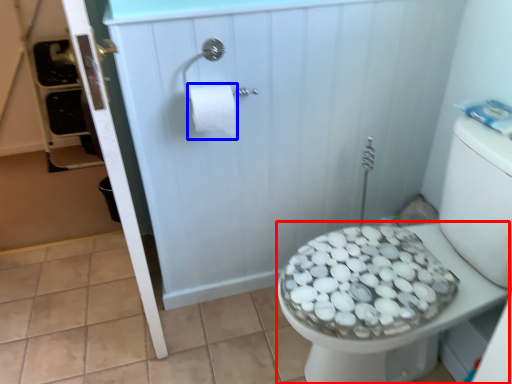
Question: Which object is closer to the camera taking this photo, bidet (highlighted by a red box) or toilet paper (highlighted by a blue box)?

Choices:
 (A) bidet
 (B) toilet paper

Answer: (A)